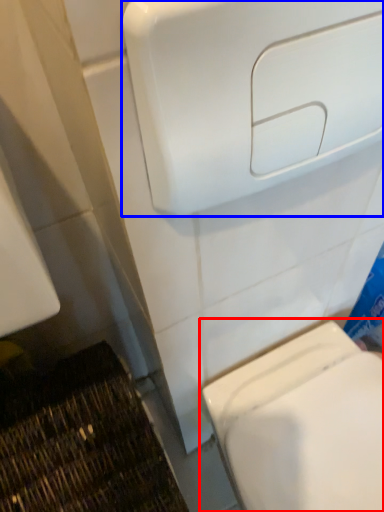
Question: Among these objects, which one is farthest to the camera, toilet (highlighted by a red box) or hand dryer (highlighted by a blue box)?

Choices:
 (A) toilet
 (B) hand dryer

Answer: (A)